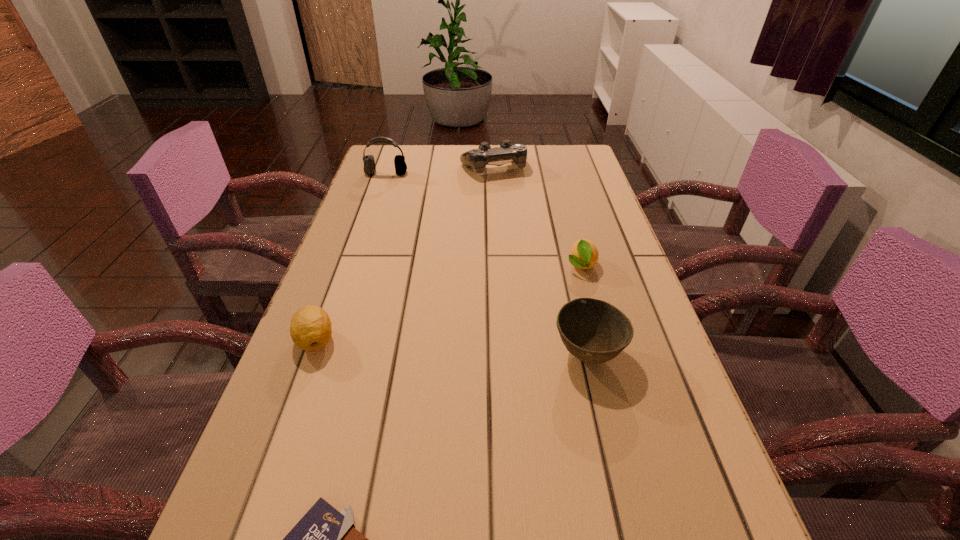
The image size is (960, 540). Find the location of `vacant space located with leaves positioned above the right lemon`. vacant space located with leaves positioned above the right lemon is located at coordinates (610, 370).

Identify the location of headset that is positioned at the far edge. The width and height of the screenshot is (960, 540). pos(369,168).

Image resolution: width=960 pixels, height=540 pixels. Identify the location of control that is positioned at the far edge. (478, 158).

At what (x,y) coordinates should I click in order to perform the action: click on headset located at the left edge. Please return your answer as a coordinate pair (x, y). Looking at the image, I should click on (369, 168).

Image resolution: width=960 pixels, height=540 pixels. Find the location of `lemon located at the left edge`. lemon located at the left edge is located at coordinates (310, 329).

Find the location of a particular element. This screenshot has height=540, width=960. bowl that is positioned at the right edge is located at coordinates (594, 331).

Where is `lemon at the right edge`? lemon at the right edge is located at coordinates (584, 254).

Image resolution: width=960 pixels, height=540 pixels. I want to click on object that is at the far left corner, so click(x=369, y=168).

At what (x,y) coordinates should I click in order to perform the action: click on free region at the far edge. Please return your answer as a coordinate pair (x, y). Looking at the image, I should click on (443, 146).

In order to click on vacant space at the left edge in this screenshot , I will do `click(391, 246)`.